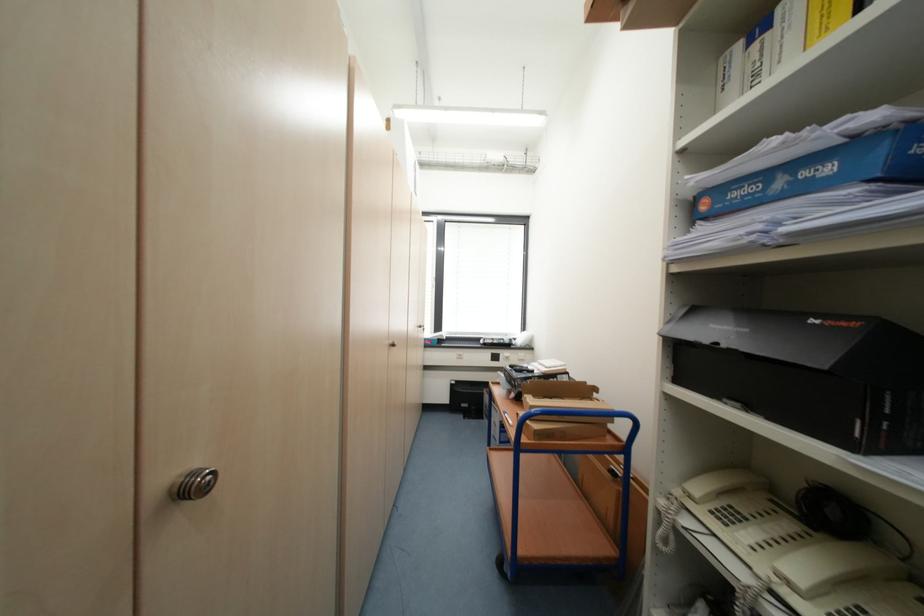
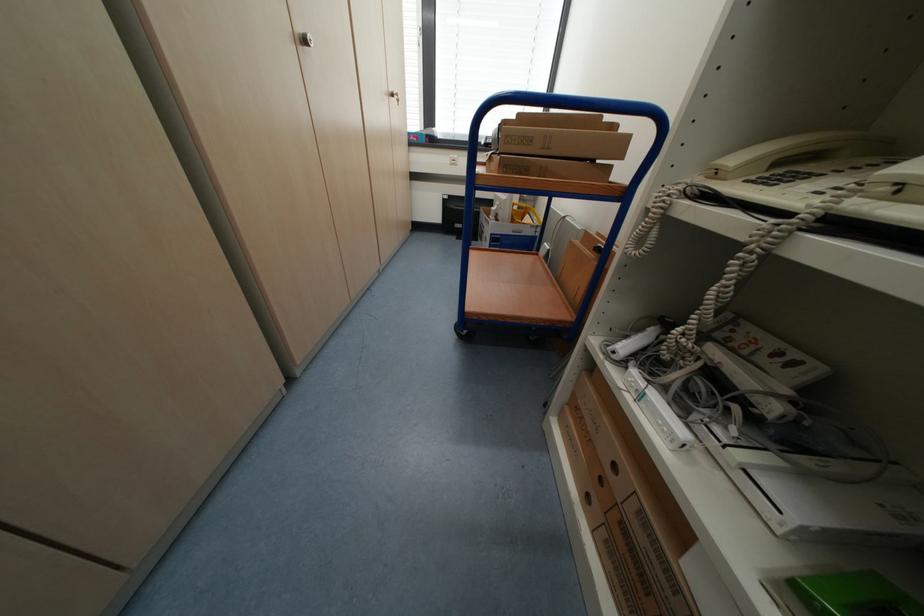
Find the pixel in the second image that matches point (529, 440) in the first image.

(485, 171)